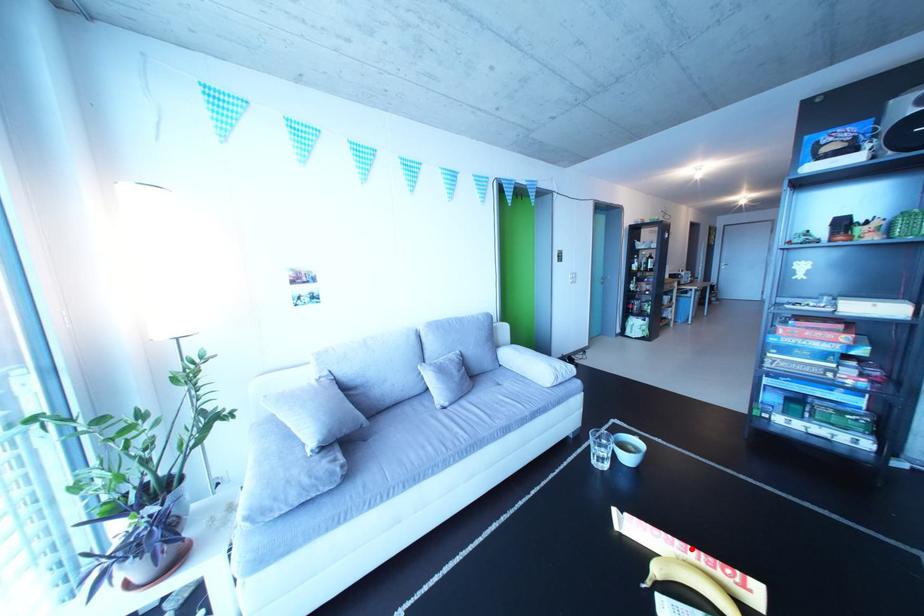
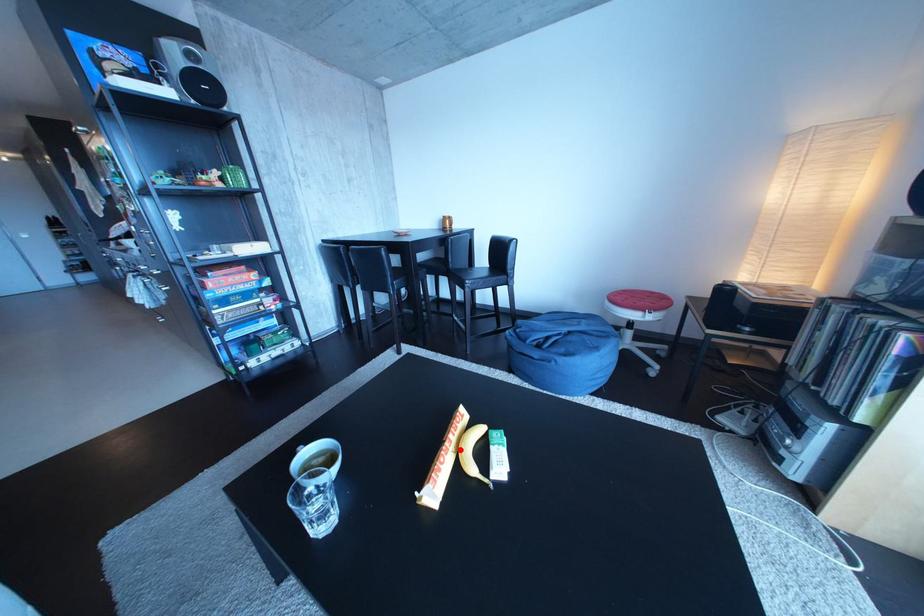
I am providing you with two images of the same scene from different viewpoints. A red point is marked on the first image and another point is marked on the second image. Is the red point in image1 aligned with the point shown in image2?

Yes